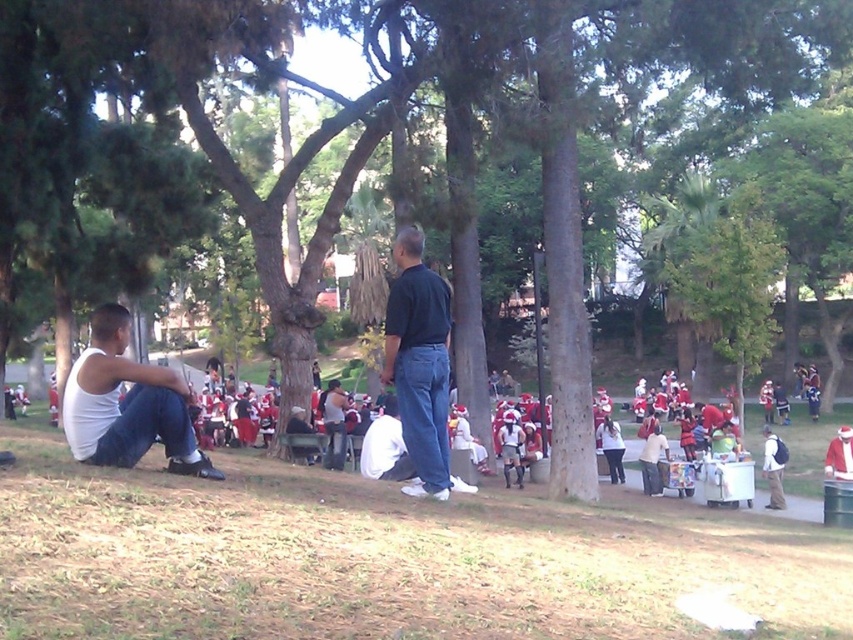
You are a photographer standing at the center of the park. You need to take a photo that includes both the black matte shirt at center and the white matte shirt at lower right. Given that your camera has a maximum focus range of 10 meters, will you be able to capture both subjects in focus at the same time?

The distance between the black matte shirt at center and the white matte shirt at lower right is 9.84 meters. Since the camera can focus up to 10 meters, you can capture both subjects in focus simultaneously.

Consider the image. You are standing in the park and see the point at coordinates (419, 362). What object is located at that point?

The point at coordinates (419, 362) corresponds to the black matte shirt at center.

You are a photographer positioned in the park and want to capture a photo that includes both the white matte tank top at left and the white matte uniform at center. Based on their positions, which one should you focus on first to ensure both are in the frame?

The white matte tank top at left is above the white matte uniform at center, so you should focus on the white matte uniform at center first to ensure both are in the frame.